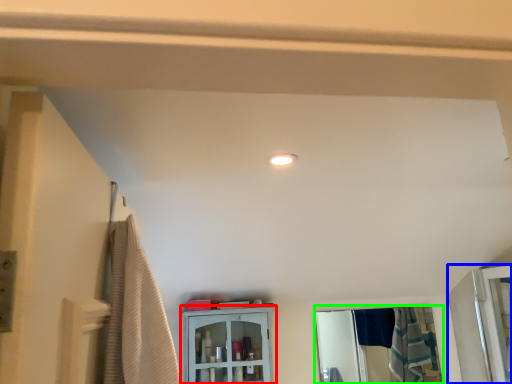
Question: Which object is the closest to the cabinetry (highlighted by a red box)? Choose among these: screen door (highlighted by a blue box) or mirror (highlighted by a green box).

Choices:
 (A) screen door
 (B) mirror

Answer: (A)